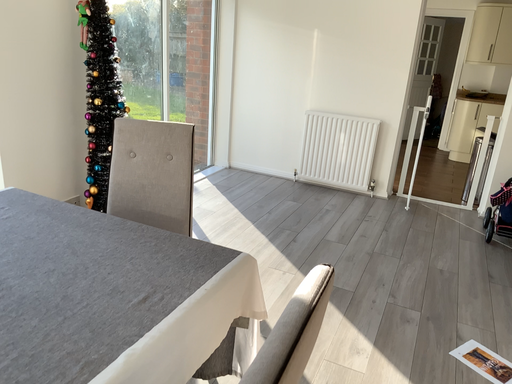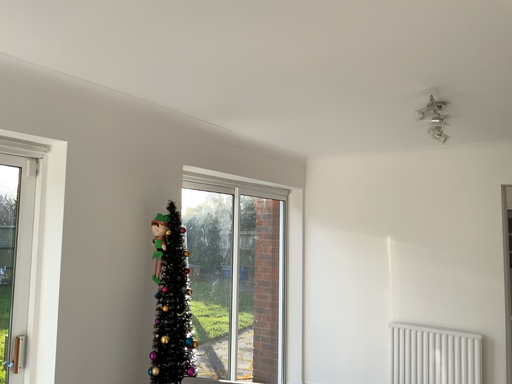
Question: How did the camera likely rotate when shooting the video?

Choices:
 (A) rotated right
 (B) rotated left

Answer: (B)